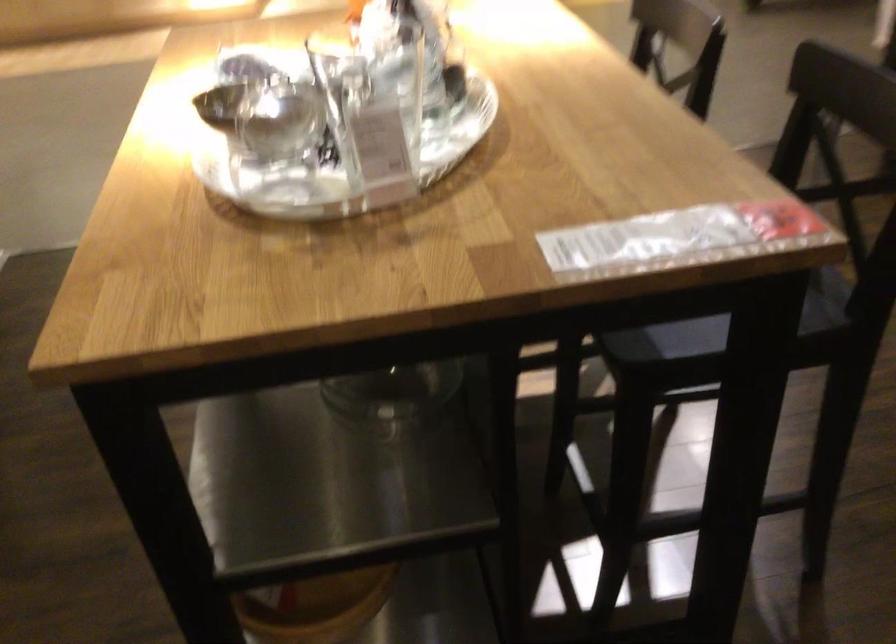
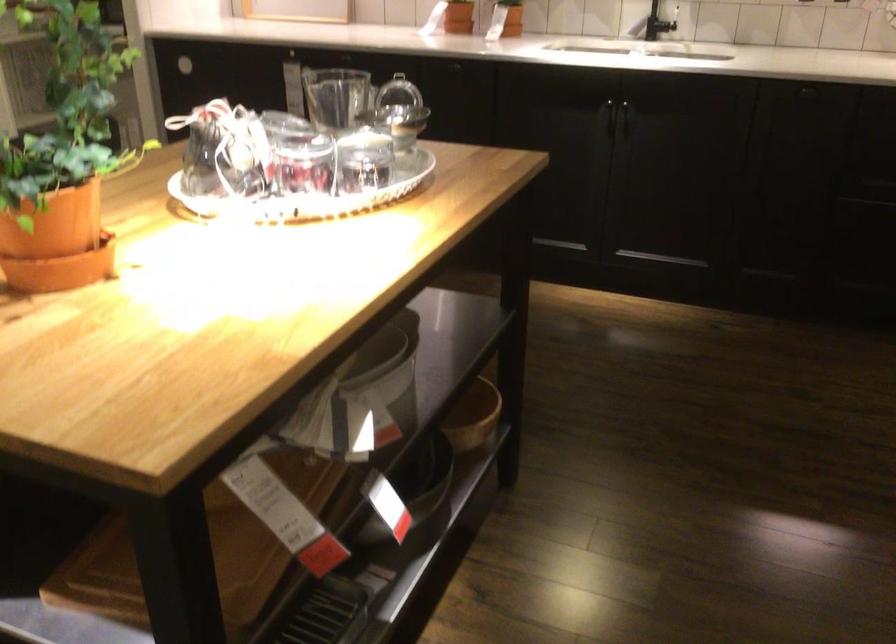
Question: I am providing you with two images of the same scene from different viewpoints. Which of the following objects are not visible in image2?

Choices:
 (A) dome lid handle
 (B) wooden bowl
 (C) plastic wrapped item
 (D) white sun hat

Answer: (C)